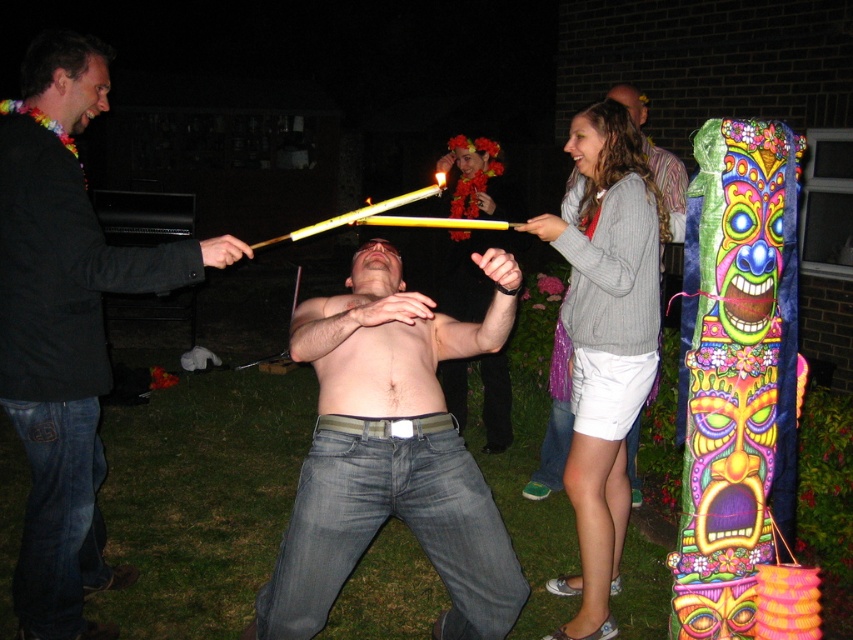
You are at a party and need to decide which item is larger between the denim jeans at center and the matte black shirt at upper center. Which one should you choose?

The denim jeans at center is bigger than the matte black shirt at upper center, so you should choose the denim jeans at center.

You are organizing a small outdoor event and need to arrange two items from the scene. The denim jeans at center and the black leather jacket at left must be placed on a narrow shelf. Which item should you choose to ensure it fits without overlapping?

The denim jeans at center should be chosen because it occupies less space than the black leather jacket at left, making it more likely to fit on the narrow shelf without overlapping.